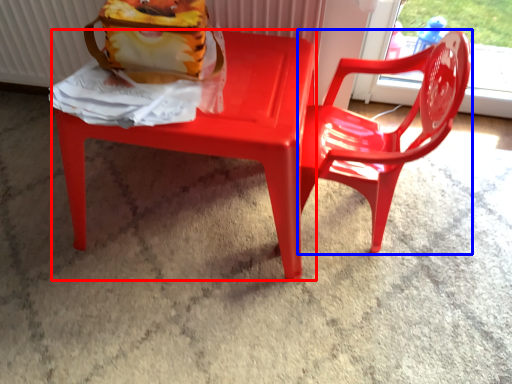
Question: Which point is further to the camera, chair (highlighted by a red box) or chair (highlighted by a blue box)?

Choices:
 (A) chair
 (B) chair

Answer: (A)